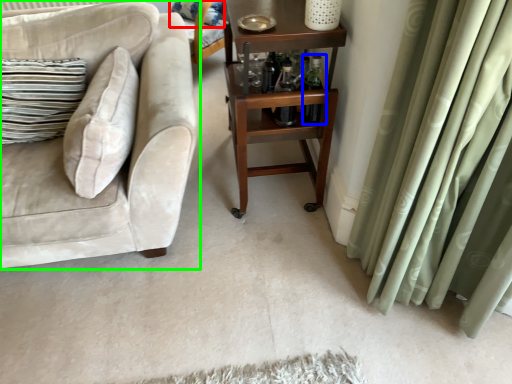
Question: Which object is positioned farthest from pillow (highlighted by a red box)? Select from bottle (highlighted by a blue box) and studio couch (highlighted by a green box).

Choices:
 (A) bottle
 (B) studio couch

Answer: (A)